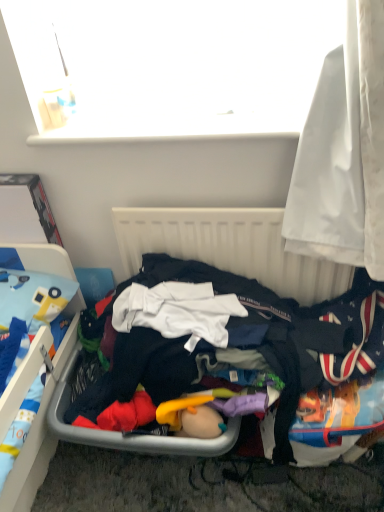
Image resolution: width=384 pixels, height=512 pixels. What do you see at coordinates (241, 355) in the screenshot?
I see `dark blue fabric at center` at bounding box center [241, 355].

Locate an element on the screen. dark blue fabric at center is located at coordinates [241, 355].

Who is taller, white plastic radiator at center or dark blue fabric at center?

With more height is white plastic radiator at center.

Is dark blue fabric at center inside white plastic radiator at center?

No, white plastic radiator at center does not contain dark blue fabric at center.

In the scene shown: From the image's perspective, would you say white plastic radiator at center is shown under dark blue fabric at center?

Incorrect, from the image's perspective, white plastic radiator at center is higher than dark blue fabric at center.

Is white fabric curtain at right aimed at white plastic radiator at center?

No, white fabric curtain at right is not aimed at white plastic radiator at center.

From the image's perspective, which one is positioned higher, white fabric curtain at right or white plastic radiator at center?

white fabric curtain at right appears higher in the image.

Which of these two, white fabric curtain at right or white plastic radiator at center, is thinner?

white plastic radiator at center.

Considering the relative sizes of white fabric curtain at right and white plastic radiator at center in the image provided, is white fabric curtain at right smaller than white plastic radiator at center?

No.

Looking at the image, does dark blue fabric at center seem bigger or smaller compared to white plastic radiator at center?

Clearly, dark blue fabric at center is larger in size than white plastic radiator at center.

From the image's perspective, who appears lower, dark blue fabric at center or white plastic radiator at center?

dark blue fabric at center, from the image's perspective.

Is dark blue fabric at center to the left or to the right of white plastic radiator at center in the image?

From the image, it's evident that dark blue fabric at center is to the left of white plastic radiator at center.

From their relative heights in the image, would you say dark blue fabric at center is taller or shorter than white plastic radiator at center?

In the image, dark blue fabric at center appears to be shorter than white plastic radiator at center.

Can you confirm if white plastic radiator at center is thinner than white fabric curtain at right?

Indeed, white plastic radiator at center has a lesser width compared to white fabric curtain at right.

Between white plastic radiator at center and white fabric curtain at right, which one has less height?

Standing shorter between the two is white plastic radiator at center.

Does white plastic radiator at center turn towards white fabric curtain at right?

No, white plastic radiator at center is not turned towards white fabric curtain at right.

Which is more to the left, white fabric curtain at right or dark blue fabric at center?

Positioned to the left is dark blue fabric at center.

Is white fabric curtain at right turned away from dark blue fabric at center?

white fabric curtain at right is not turned away from dark blue fabric at center.

Is white fabric curtain at right next to dark blue fabric at center and touching it?

No, white fabric curtain at right is not making contact with dark blue fabric at center.

From the image's perspective, which is above, dark blue fabric at center or white fabric curtain at right?

From the image's view, white fabric curtain at right is above.

Between dark blue fabric at center and white fabric curtain at right, which one has less height?

dark blue fabric at center.

Does point (197, 329) come farther from viewer compared to point (334, 225)?

Yes.

Find the location of a particular element. The image size is (384, 512). clothing in front of the white plastic radiator at center is located at coordinates (241, 355).

The image size is (384, 512). In order to click on radiator below the white fabric curtain at right (from the image's perspective) in this screenshot , I will do `click(229, 247)`.

Consider the image. Which object lies nearer to the anchor point white plastic radiator at center, dark blue fabric at center or white fabric curtain at right?

Based on the image, dark blue fabric at center appears to be nearer to white plastic radiator at center.

Looking at the image, which one is located further to white plastic radiator at center, white fabric curtain at right or dark blue fabric at center?

Among the two, white fabric curtain at right is located further to white plastic radiator at center.

Looking at the image, which one is located further to dark blue fabric at center, white fabric curtain at right or white plastic radiator at center?

The object further to dark blue fabric at center is white fabric curtain at right.

Estimate the real-world distances between objects in this image. Which object is further from white fabric curtain at right, white plastic radiator at center or dark blue fabric at center?

dark blue fabric at center lies further to white fabric curtain at right than the other object.

Considering their positions, is white plastic radiator at center positioned closer to dark blue fabric at center than white fabric curtain at right?

Based on the image, white plastic radiator at center appears to be nearer to dark blue fabric at center.

Estimate the real-world distances between objects in this image. Which object is further from white fabric curtain at right, dark blue fabric at center or white plastic radiator at center?

The object further to white fabric curtain at right is dark blue fabric at center.

Find the location of a particular element. Image resolution: width=384 pixels, height=512 pixels. radiator between white fabric curtain at right and dark blue fabric at center vertically is located at coordinates (229, 247).